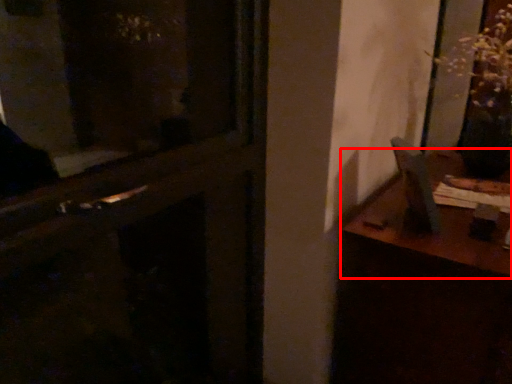
Question: From the image's perspective, what is the correct spatial relationship of table (annotated by the red box) in relation to door?

Choices:
 (A) above
 (B) below

Answer: (B)